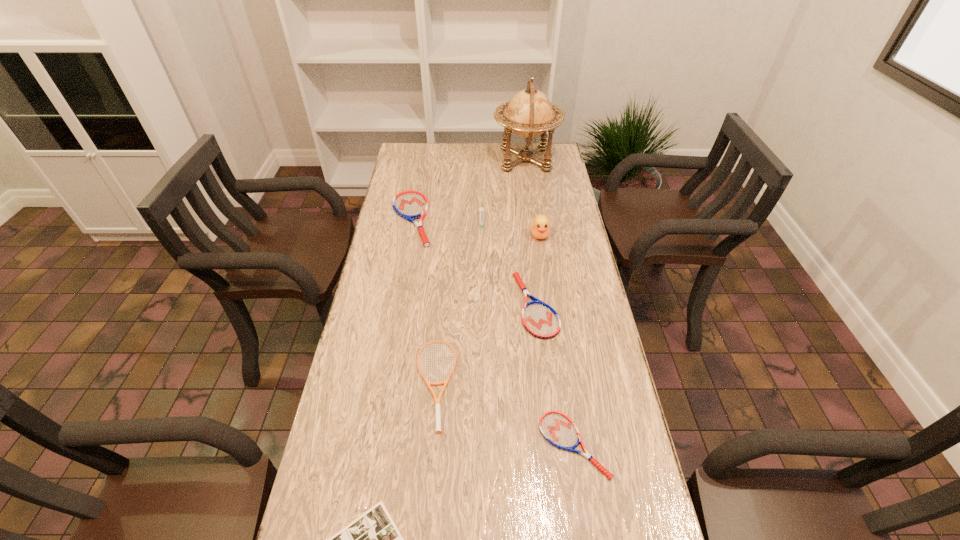
I want to click on beige tennis racket, so click(x=437, y=400).

Locate an element on the screen. This screenshot has width=960, height=540. the shortest tennis racket is located at coordinates (558, 429).

Find the location of a particular element. The height and width of the screenshot is (540, 960). the nearest blue tennis racket is located at coordinates click(x=558, y=429).

This screenshot has height=540, width=960. Identify the location of vacant region located on the front-facing side of the globe. (464, 160).

The image size is (960, 540). I want to click on free space located 0.280m on the front-facing side of the globe, so click(x=430, y=160).

Where is `free space located on the front-facing side of the globe`? free space located on the front-facing side of the globe is located at coordinates (462, 160).

You are a GUI agent. You are given a task and a screenshot of the screen. Output one action in this format:
    pyautogui.click(x=<x>, y=<y>)
    Task: Click on the free space located on the face of the yellow duckling
    The image size is (960, 540).
    Given the screenshot: What is the action you would take?
    pyautogui.click(x=547, y=286)

Where is `vacant space located 0.380m on the front of the biggest blue tennis racket`? The width and height of the screenshot is (960, 540). vacant space located 0.380m on the front of the biggest blue tennis racket is located at coordinates (392, 334).

Find the location of a particular element. vacant region located at the needle end of the syringe is located at coordinates pos(482,274).

Identify the location of vacant space located 0.070m on the back of the fourth nearest object. This screenshot has height=540, width=960. (531, 261).